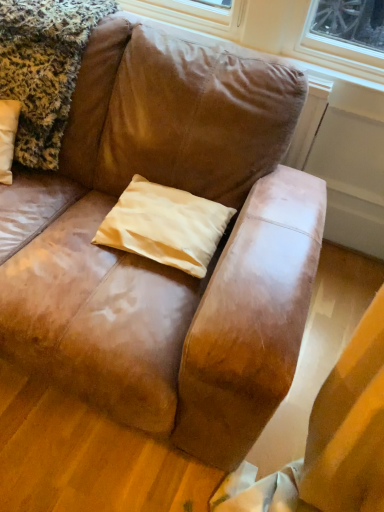
Question: Can fluffy leopard print blanket at upper left be found inside beige satin pillow at center?

Choices:
 (A) no
 (B) yes

Answer: (A)

Question: Considering the relative sizes of beige satin pillow at center and fluffy leopard print blanket at upper left in the image provided, is beige satin pillow at center thinner than fluffy leopard print blanket at upper left?

Choices:
 (A) no
 (B) yes

Answer: (B)

Question: Would you say beige satin pillow at center is outside fluffy leopard print blanket at upper left?

Choices:
 (A) yes
 (B) no

Answer: (A)

Question: Is beige satin pillow at center facing away from fluffy leopard print blanket at upper left?

Choices:
 (A) yes
 (B) no

Answer: (B)

Question: Is the depth of beige satin pillow at center greater than that of fluffy leopard print blanket at upper left?

Choices:
 (A) no
 (B) yes

Answer: (B)

Question: Is beige satin pillow at center bigger than fluffy leopard print blanket at upper left?

Choices:
 (A) yes
 (B) no

Answer: (B)

Question: Considering the relative sizes of fluffy leopard print blanket at upper left and beige satin pillow at center in the image provided, is fluffy leopard print blanket at upper left wider than beige satin pillow at center?

Choices:
 (A) yes
 (B) no

Answer: (A)

Question: From a real-world perspective, does fluffy leopard print blanket at upper left sit lower than beige satin pillow at center?

Choices:
 (A) yes
 (B) no

Answer: (B)

Question: Is fluffy leopard print blanket at upper left looking in the opposite direction of beige satin pillow at center?

Choices:
 (A) yes
 (B) no

Answer: (B)

Question: Would you consider fluffy leopard print blanket at upper left to be distant from beige satin pillow at center?

Choices:
 (A) yes
 (B) no

Answer: (B)

Question: Considering the relative positions of fluffy leopard print blanket at upper left and beige satin pillow at center in the image provided, is fluffy leopard print blanket at upper left to the right of beige satin pillow at center from the viewer's perspective?

Choices:
 (A) no
 (B) yes

Answer: (A)

Question: Does fluffy leopard print blanket at upper left have a smaller size compared to beige satin pillow at center?

Choices:
 (A) yes
 (B) no

Answer: (B)

Question: Does point (213, 217) appear closer or farther from the camera than point (39, 125)?

Choices:
 (A) closer
 (B) farther

Answer: (A)